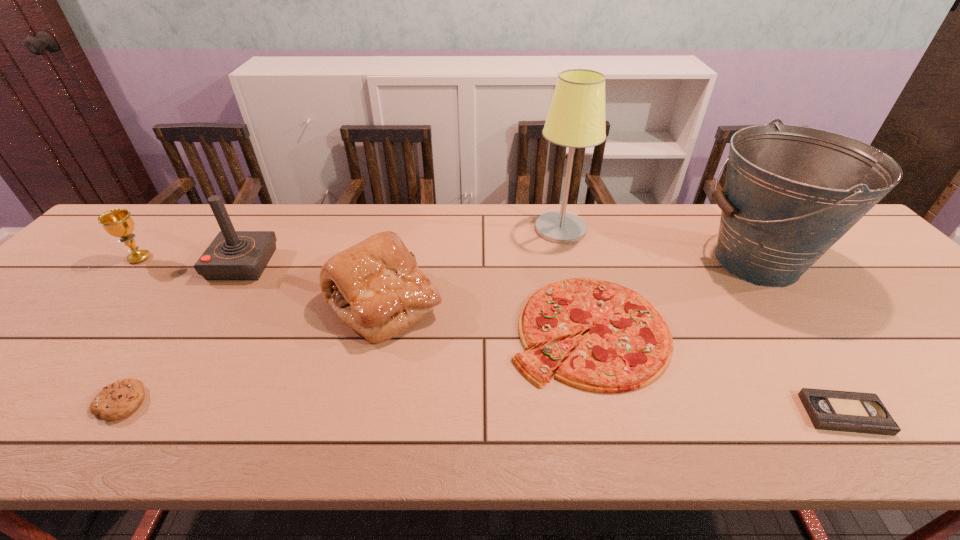
The image size is (960, 540). I want to click on table lamp, so click(576, 118).

Locate an element on the screen. The height and width of the screenshot is (540, 960). the second tallest object is located at coordinates (791, 192).

Identify the location of the sixth shortest object. This screenshot has height=540, width=960. (233, 255).

What are the coordinates of `the fourth object from left to right` in the screenshot? It's located at (375, 287).

The width and height of the screenshot is (960, 540). I want to click on the leftmost object, so click(x=117, y=222).

Locate an element on the screen. The image size is (960, 540). pizza is located at coordinates (628, 345).

I want to click on cookie, so click(x=119, y=399).

Image resolution: width=960 pixels, height=540 pixels. I want to click on videotape, so click(845, 411).

Identify the location of vacant space positioned 0.190m on the front of the tallest object. (575, 290).

Where is `free space located with the handle on opposite sides of the bucket`? The width and height of the screenshot is (960, 540). free space located with the handle on opposite sides of the bucket is located at coordinates (560, 262).